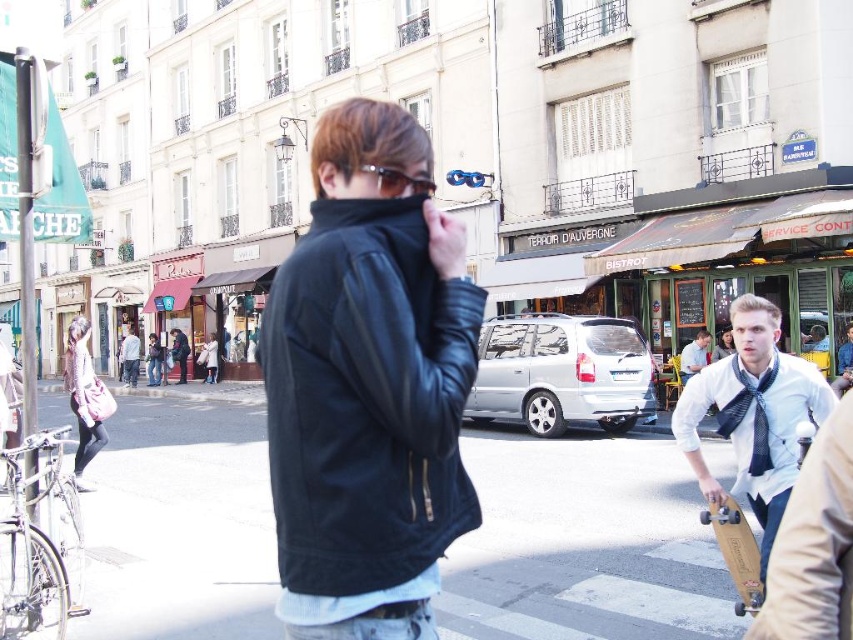
You are a delivery person who needs to park your silver metallic van at center in a spot that allows you to unload items onto the wooden skateboard at lower right. Based on the scene, can you park the van directly above the skateboard to make unloading easier?

The silver metallic van at center is already positioned above the wooden skateboard at lower right, so yes, you can park the van in its current position to facilitate easy unloading.